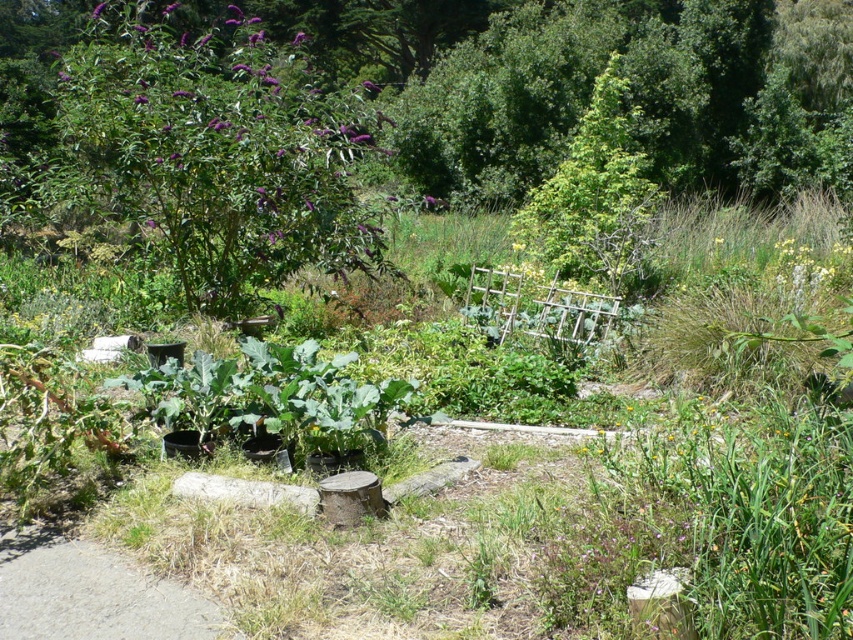
Question: Does green leafy tree at upper center appear over gray asphalt path at lower left?

Choices:
 (A) yes
 (B) no

Answer: (A)

Question: Based on their relative distances, which object is farther from the gray asphalt path at lower left?

Choices:
 (A) purple leafy bush at upper left
 (B) green leafy tree at upper center

Answer: (B)

Question: Which is nearer to the gray asphalt path at lower left?

Choices:
 (A) green leafy tree at upper center
 (B) purple leafy bush at upper left

Answer: (B)

Question: Is purple leafy bush at upper left below green leafy tree at upper center?

Choices:
 (A) yes
 (B) no

Answer: (B)

Question: Is green leafy tree at upper center smaller than gray asphalt path at lower left?

Choices:
 (A) no
 (B) yes

Answer: (A)

Question: Which object is farther from the camera taking this photo?

Choices:
 (A) gray asphalt path at lower left
 (B) green leafy tree at upper center
 (C) purple leafy bush at upper left

Answer: (B)